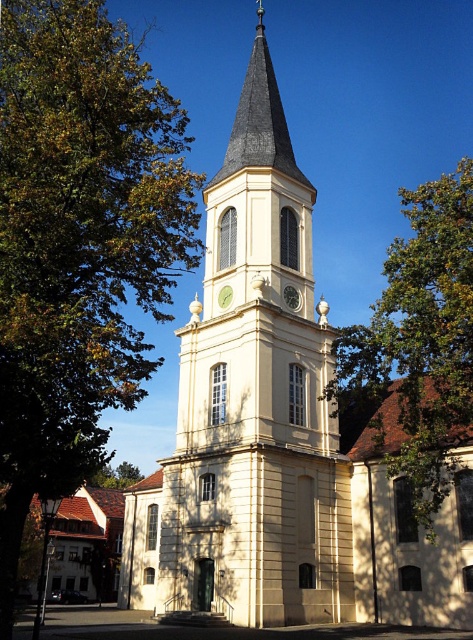
Question: Which point appears farthest from the camera in this image?

Choices:
 (A) (325, 525)
 (B) (294, 288)

Answer: (B)

Question: Among these objects, which one is farthest from the camera?

Choices:
 (A) metallic clock face at upper center
 (B) green leafy tree at center
 (C) gold metallic clock at center

Answer: (C)

Question: Is metallic clock face at upper center thinner than gold metallic clock at center?

Choices:
 (A) no
 (B) yes

Answer: (A)

Question: Which of the following is the closest to the observer?

Choices:
 (A) (289, 300)
 (B) (238, 221)
 (C) (388, 269)
 (D) (24, 470)

Answer: (D)

Question: Does green leafy tree at upper left have a smaller size compared to gold metallic clock at center?

Choices:
 (A) no
 (B) yes

Answer: (A)

Question: Considering the relative positions of green leafy tree at center and gold metallic clock at center in the image provided, where is green leafy tree at center located with respect to gold metallic clock at center?

Choices:
 (A) left
 (B) right

Answer: (B)